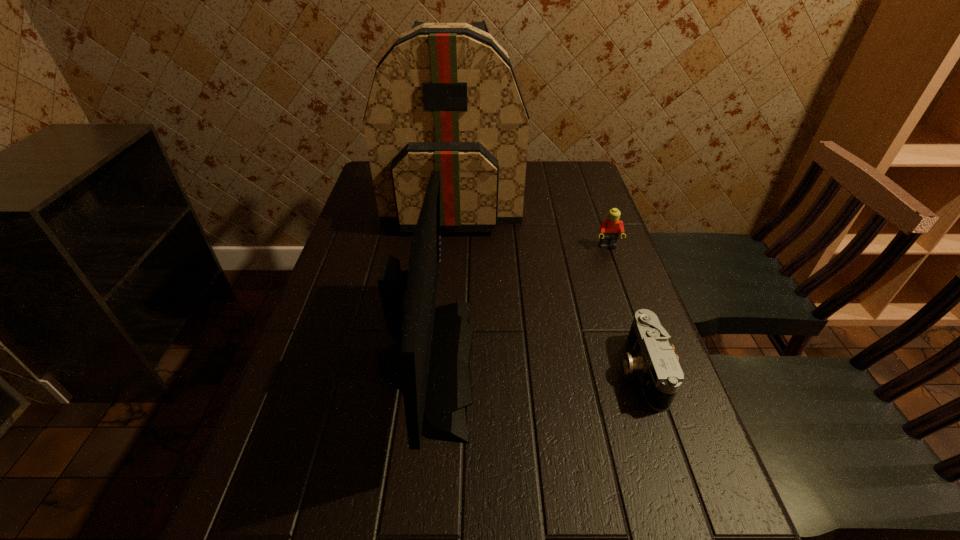
Identify the location of blank area located on the lens of the shortest object. (578, 370).

Locate an element on the screen. This screenshot has width=960, height=540. vacant point located on the lens of the shortest object is located at coordinates (506, 370).

You are a GUI agent. You are given a task and a screenshot of the screen. Output one action in this format:
    pyautogui.click(x=<x>, y=<y>)
    Task: Click on the object that is at the far edge
    This screenshot has width=960, height=540.
    Given the screenshot: What is the action you would take?
    pyautogui.click(x=444, y=97)

I want to click on object located in the left edge section of the desktop, so click(444, 97).

The height and width of the screenshot is (540, 960). Identify the location of Lego at the right edge. (610, 228).

Where is `camera that is at the right edge`? This screenshot has width=960, height=540. camera that is at the right edge is located at coordinates (652, 357).

Locate an element on the screen. object that is at the far left corner is located at coordinates (444, 97).

Locate an element on the screen. Image resolution: width=960 pixels, height=540 pixels. vacant space at the left edge of the desktop is located at coordinates (334, 281).

You are a GUI agent. You are given a task and a screenshot of the screen. Output one action in this format:
    pyautogui.click(x=<x>, y=<y>)
    Task: Click on the vacant space at the right edge
    
    Given the screenshot: What is the action you would take?
    pyautogui.click(x=618, y=363)

Find the location of a particular element. free location at the far right corner of the desktop is located at coordinates (584, 180).